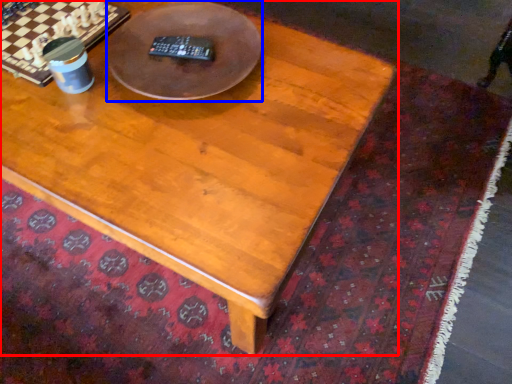
Question: Which point is further to the camera, coffee table (highlighted by a red box) or round table (highlighted by a blue box)?

Choices:
 (A) coffee table
 (B) round table

Answer: (B)